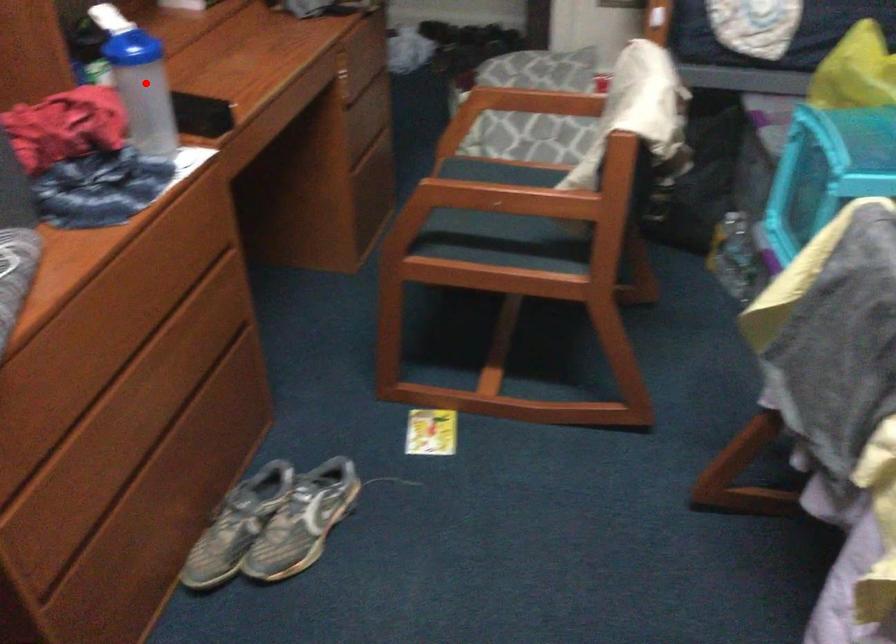
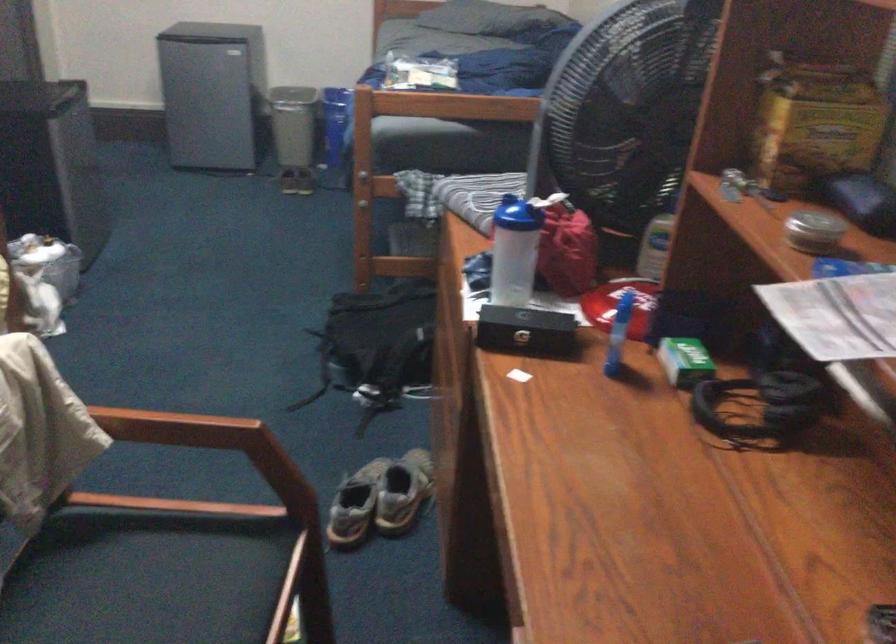
Locate, in the second image, the point that corresponds to the highlighted location in the first image.

(513, 251)